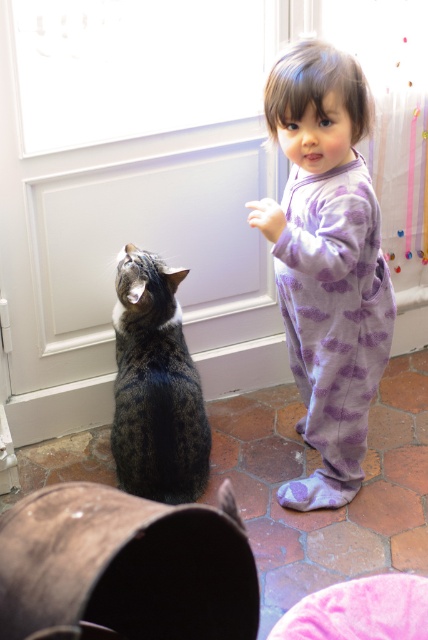
Question: Which object appears farthest from the camera in this image?

Choices:
 (A) purple fleece onesie at center
 (B) tabby fur cat at lower left

Answer: (B)

Question: Which point appears farthest from the camera in this image?

Choices:
 (A) (148, 307)
 (B) (71, 248)

Answer: (B)

Question: Which object is closer to the camera taking this photo?

Choices:
 (A) purple fleece onesie at center
 (B) white glossy screen door at center
 (C) tabby fur cat at lower left

Answer: (A)

Question: Can you confirm if purple fleece onesie at center is smaller than tabby fur cat at lower left?

Choices:
 (A) yes
 (B) no

Answer: (B)

Question: Observing the image, what is the correct spatial positioning of purple fleece onesie at center in reference to tabby fur cat at lower left?

Choices:
 (A) above
 (B) below

Answer: (A)

Question: Does white glossy screen door at center appear over tabby fur cat at lower left?

Choices:
 (A) yes
 (B) no

Answer: (A)